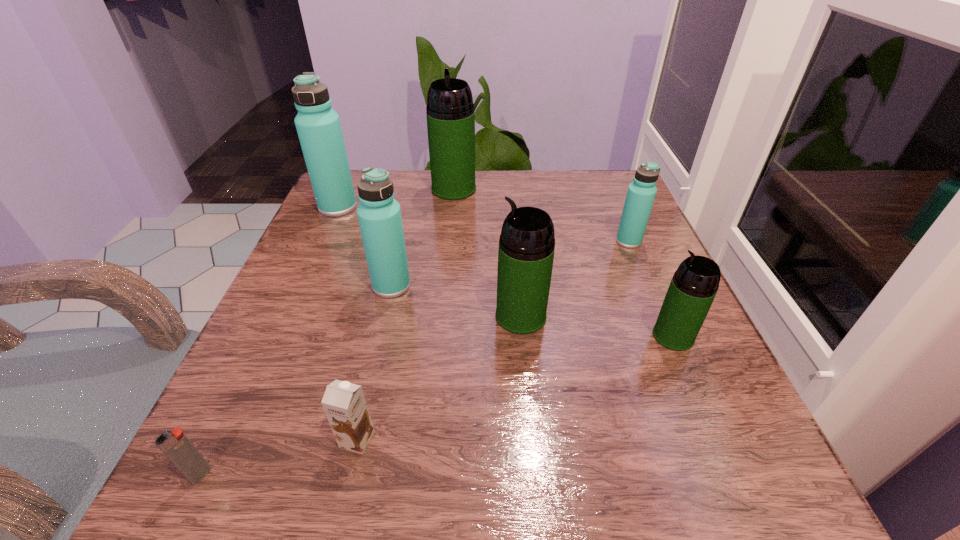
Identify the location of the third thermos bottle from left to right. This screenshot has width=960, height=540. (450, 113).

This screenshot has width=960, height=540. Find the location of `the fifth object from left to right`. the fifth object from left to right is located at coordinates (450, 113).

Where is `the biggest aqua thermos bottle`? The image size is (960, 540). the biggest aqua thermos bottle is located at coordinates (318, 126).

This screenshot has width=960, height=540. What are the coordinates of `the leftmost thermos bottle` in the screenshot? It's located at (318, 126).

The image size is (960, 540). I want to click on the nearest aqua thermos bottle, so point(379,214).

You are a GUI agent. You are given a task and a screenshot of the screen. Output one action in this format:
    pyautogui.click(x=<x>, y=<y>)
    Task: Click on the second thermos bottle from left to right
    The height and width of the screenshot is (540, 960).
    Given the screenshot: What is the action you would take?
    pyautogui.click(x=379, y=214)

Identify the location of the third object from right to left. The image size is (960, 540). (526, 250).

At what (x,y) coordinates should I click in order to perform the action: click on the second biggest green thermos bottle. Please return your answer as a coordinate pair (x, y). Looking at the image, I should click on (526, 250).

The height and width of the screenshot is (540, 960). Identify the location of the fourth nearest thermos bottle. (641, 192).

Locate an element on the screen. the smallest aqua thermos bottle is located at coordinates (641, 192).